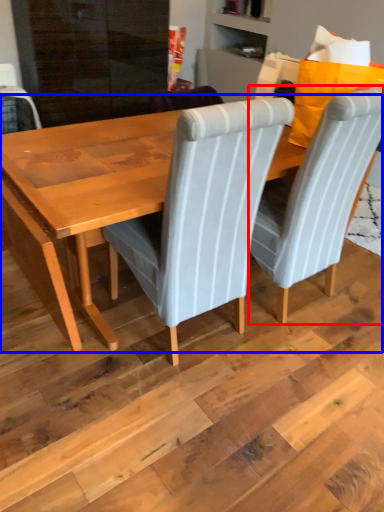
Question: Which object is further to the camera taking this photo, chair (highlighted by a red box) or table (highlighted by a blue box)?

Choices:
 (A) chair
 (B) table

Answer: (A)